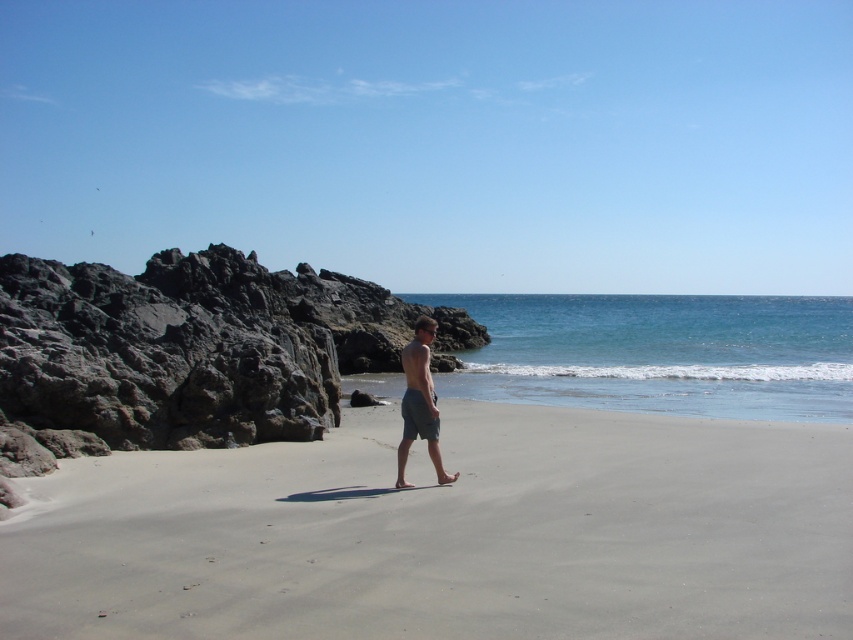
You are a geologist examining the beach scene. You need to locate the gray sand at center for analysis. According to the coordinates provided, where exactly should you look on the image?

The gray sand at center is located at coordinates point [447,532].

Looking at this image, you are a photographer trying to capture the man walking on the beach. You notice the gray sand at center and the gray cotton shorts at center. Which object in the scene has a larger size?

The gray sand at center is bigger than the gray cotton shorts at center, so the gray sand at center has a larger size.